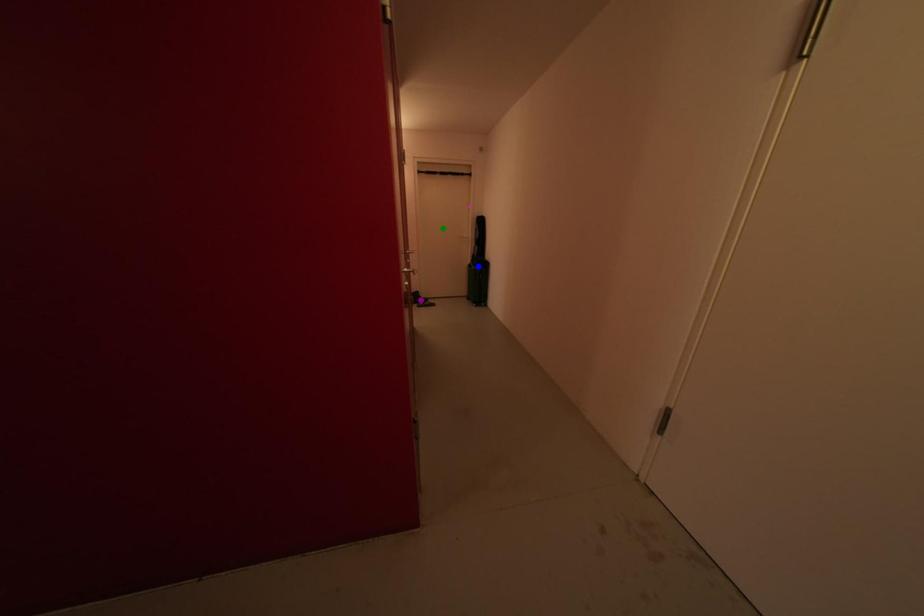
Order these from nearest to farthest:
blue point | green point | purple point

blue point, purple point, green point